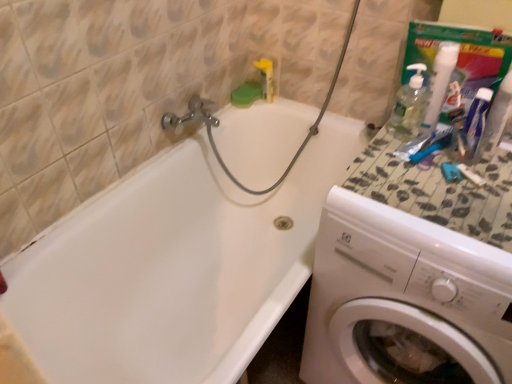
Identify the location of vacant space situated above white plastic washing machine at right (from a real-world perspective). (447, 192).